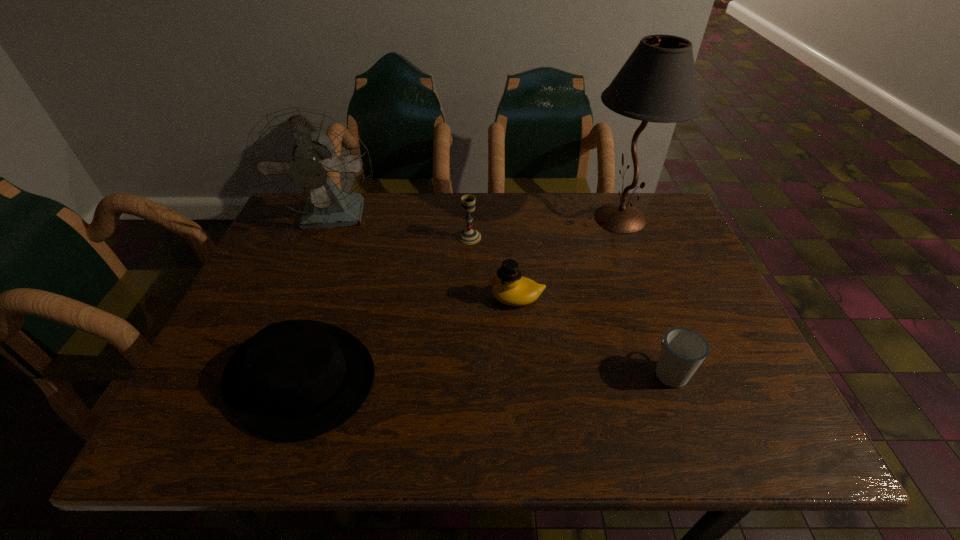
The height and width of the screenshot is (540, 960). I want to click on vacant space at the far edge of the desktop, so click(392, 194).

This screenshot has height=540, width=960. Identify the location of vacant space at the near edge of the desktop. (591, 444).

In the image, there is a desktop. Where is `vacant space at the left edge`? The height and width of the screenshot is (540, 960). vacant space at the left edge is located at coordinates pos(258,296).

In the image, there is a desktop. At what (x,y) coordinates should I click in order to perform the action: click on vacant area at the right edge. Please return your answer as a coordinate pair (x, y). The height and width of the screenshot is (540, 960). Looking at the image, I should click on (655, 259).

In the image, there is a desktop. What are the coordinates of `vacant space at the near left corner` in the screenshot? It's located at (242, 440).

In the image, there is a desktop. At what (x,y) coordinates should I click in order to perform the action: click on vacant space at the far right corner. Please return your answer as a coordinate pair (x, y). Image resolution: width=960 pixels, height=540 pixels. Looking at the image, I should click on (659, 203).

This screenshot has width=960, height=540. What are the coordinates of `free area in between the fan and the duck` in the screenshot? It's located at (426, 258).

Identify the location of free space between the chalice and the fedora. This screenshot has height=540, width=960. point(385,307).

You are a GUI agent. You are given a task and a screenshot of the screen. Output one action in this format:
    pyautogui.click(x=<x>, y=<y>)
    Task: Click on the free spot between the fourth farthest object and the tallest object
    The image size is (960, 540).
    Given the screenshot: What is the action you would take?
    pyautogui.click(x=568, y=258)

This screenshot has width=960, height=540. In order to click on free spot between the fourth object from right to left and the fedora in this screenshot , I will do (x=385, y=307).